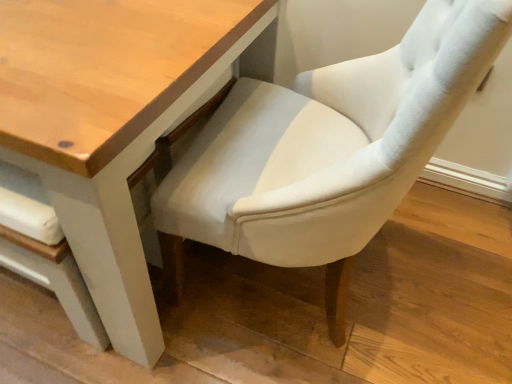
Question: From a real-world perspective, is light gray fabric chair at center under wooden table at center?

Choices:
 (A) yes
 (B) no

Answer: (B)

Question: Would you say light gray fabric chair at center contains wooden table at center?

Choices:
 (A) no
 (B) yes

Answer: (A)

Question: Does light gray fabric chair at center have a smaller size compared to wooden table at center?

Choices:
 (A) yes
 (B) no

Answer: (A)

Question: Is light gray fabric chair at center in contact with wooden table at center?

Choices:
 (A) no
 (B) yes

Answer: (A)

Question: Is light gray fabric chair at center not near wooden table at center?

Choices:
 (A) no
 (B) yes

Answer: (A)

Question: Considering the relative sizes of light gray fabric chair at center and wooden table at center in the image provided, is light gray fabric chair at center shorter than wooden table at center?

Choices:
 (A) yes
 (B) no

Answer: (B)

Question: Can you confirm if wooden table at center is shorter than light gray fabric chair at center?

Choices:
 (A) no
 (B) yes

Answer: (B)

Question: Is wooden table at center in contact with light gray fabric chair at center?

Choices:
 (A) yes
 (B) no

Answer: (B)

Question: Is wooden table at center aimed at light gray fabric chair at center?

Choices:
 (A) yes
 (B) no

Answer: (B)

Question: Is wooden table at center not near light gray fabric chair at center?

Choices:
 (A) no
 (B) yes

Answer: (A)

Question: From the image's perspective, does wooden table at center appear lower than light gray fabric chair at center?

Choices:
 (A) yes
 (B) no

Answer: (B)

Question: Considering the relative positions of wooden table at center and light gray fabric chair at center in the image provided, is wooden table at center to the left of light gray fabric chair at center from the viewer's perspective?

Choices:
 (A) no
 (B) yes

Answer: (B)

Question: Looking at their shapes, would you say wooden table at center is wider or thinner than light gray fabric chair at center?

Choices:
 (A) thin
 (B) wide

Answer: (B)